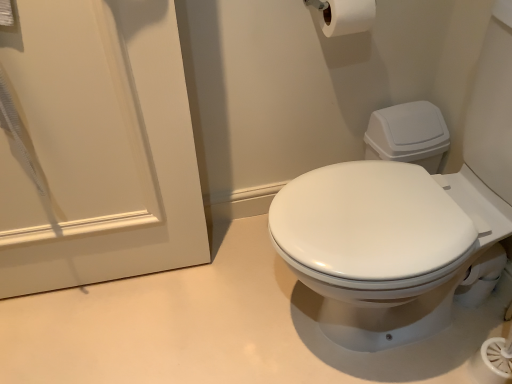
You are a GUI agent. You are given a task and a screenshot of the screen. Output one action in this format:
    pyautogui.click(x=<x>, y=<y>)
    Task: Click on the free region under white matte door at upper left (from a real-world perspective)
    This screenshot has height=384, width=512.
    Given the screenshot: What is the action you would take?
    pyautogui.click(x=106, y=283)